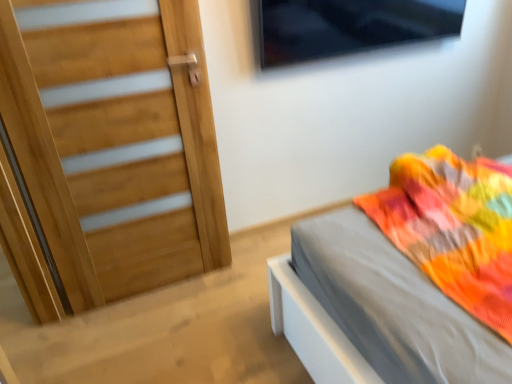
Locate an element on the screen. vacant space underneath natural wood door at left (from a real-world perspective) is located at coordinates (148, 293).